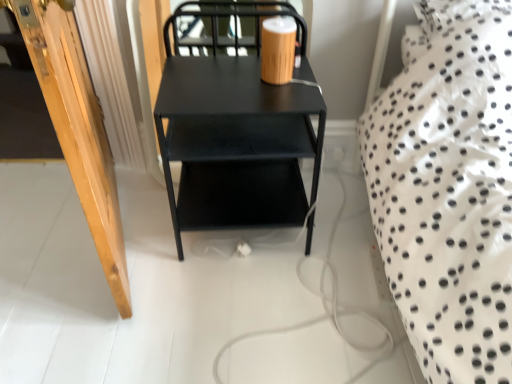
Question: Considering the relative positions of matte black table at center and wooden door at left in the image provided, is matte black table at center to the left or to the right of wooden door at left?

Choices:
 (A) right
 (B) left

Answer: (A)

Question: Based on their sizes in the image, would you say matte black table at center is bigger or smaller than wooden door at left?

Choices:
 (A) big
 (B) small

Answer: (A)

Question: Choose the correct answer: Is matte black table at center inside wooden door at left or outside it?

Choices:
 (A) outside
 (B) inside

Answer: (A)

Question: In the image, is wooden door at left on the left side or the right side of matte black table at center?

Choices:
 (A) left
 (B) right

Answer: (A)

Question: Is point (120, 263) closer or farther from the camera than point (252, 218)?

Choices:
 (A) farther
 (B) closer

Answer: (B)

Question: Is wooden door at left in front of or behind matte black table at center in the image?

Choices:
 (A) front
 (B) behind

Answer: (A)

Question: Is wooden door at left inside the boundaries of matte black table at center, or outside?

Choices:
 (A) inside
 (B) outside

Answer: (B)